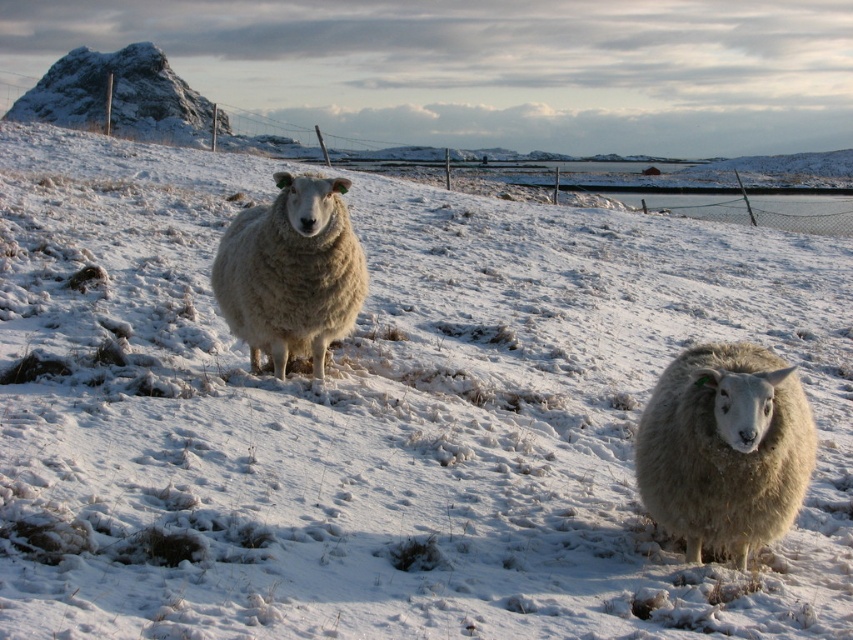
Question: Which point is farther to the camera?

Choices:
 (A) (699, 499)
 (B) (299, 186)

Answer: (B)

Question: Can you confirm if white woolly sheep at lower right is positioned below white woolly sheep at center?

Choices:
 (A) no
 (B) yes

Answer: (B)

Question: Among these objects, which one is farthest from the camera?

Choices:
 (A) white woolly sheep at lower right
 (B) white woolly sheep at center

Answer: (B)

Question: Is white woolly sheep at lower right further to camera compared to white woolly sheep at center?

Choices:
 (A) yes
 (B) no

Answer: (B)

Question: Is white woolly sheep at lower right further to the viewer compared to white woolly sheep at center?

Choices:
 (A) yes
 (B) no

Answer: (B)